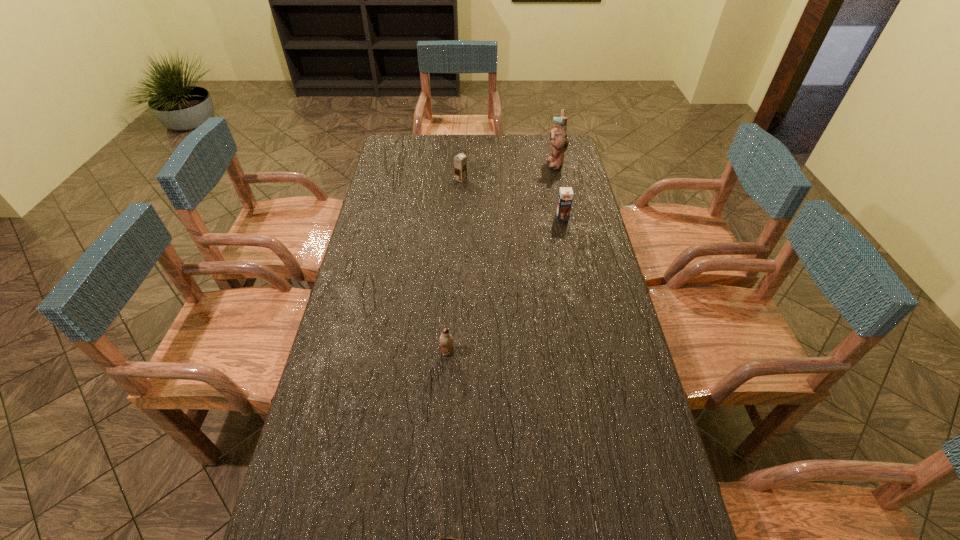
Locate an element on the screen. This screenshot has height=540, width=960. the second closest chocolate milk to the figurine is located at coordinates (460, 162).

Locate which chocolate milk is the closest to the second farthest object. Please provide its 2D coordinates. Your answer should be formatted as a tuple, i.e. [(x, y)], where the tuple contains the x and y coordinates of a point satisfying the conditions above.

[(565, 197)]

You are a GUI agent. You are given a task and a screenshot of the screen. Output one action in this format:
    pyautogui.click(x=<x>, y=<y>)
    Task: Click on the vacant area that satisfies the following two spatial constraints: 1. on the back side of the nearest chocolate milk; 2. on the left side of the farthest chocolate milk
    
    Given the screenshot: What is the action you would take?
    pyautogui.click(x=458, y=179)

I want to click on vacant space that satisfies the following two spatial constraints: 1. on the front-facing side of the farthest object; 2. on the front side of the fourth farthest object, so click(596, 352).

Locate an element on the screen. The width and height of the screenshot is (960, 540). free space that satisfies the following two spatial constraints: 1. on the front-facing side of the tallest object; 2. on the front side of the fourth nearest object is located at coordinates (559, 179).